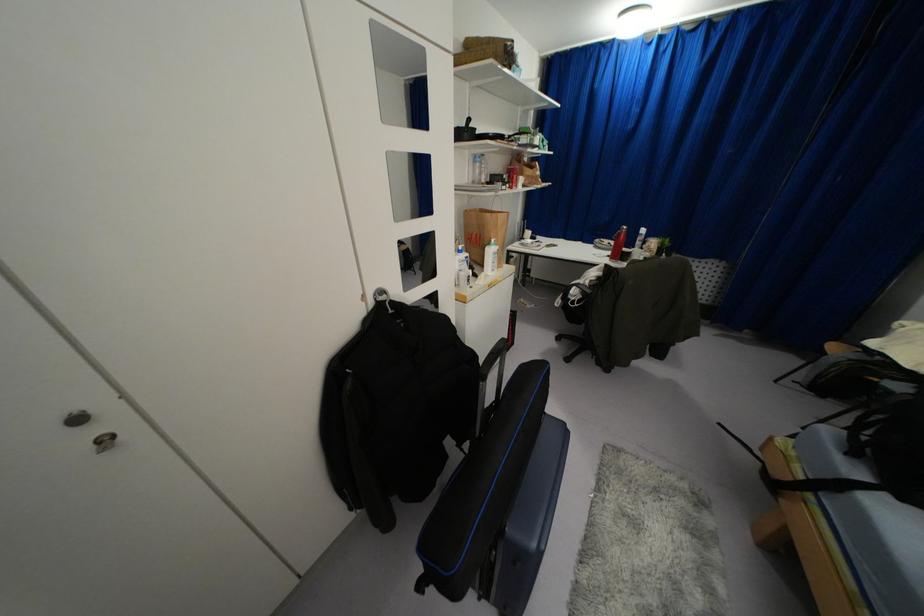
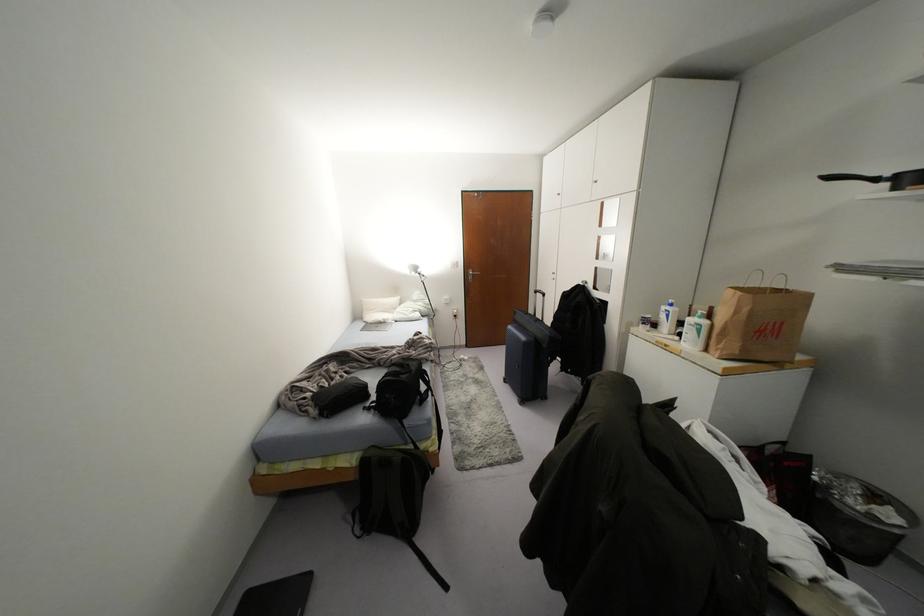
Locate, in the second image, the point that corresponds to pixel 495 246 in the first image.

(703, 322)